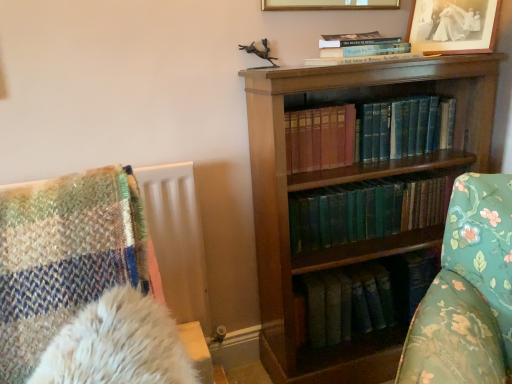
Find the location of a particular element. The width and height of the screenshot is (512, 384). black paper picture frame at upper right, which ranks as the first picture frame in right-to-left order is located at coordinates (453, 26).

Identify the location of blue leather book at center, which is the 2th book from top to bottom. (393, 130).

You are a GUI agent. You are given a task and a screenshot of the screen. Output one action in this format:
    pyautogui.click(x=<x>, y=<y>)
    Task: Click on the gold/glossy picture frame at upper center, the 2th picture frame when ordered from right to left
    
    Given the screenshot: What is the action you would take?
    pyautogui.click(x=329, y=5)

The height and width of the screenshot is (384, 512). I want to click on hardcover book at upper center, which is the first book from top to bottom, so click(361, 49).

In order to face hardcover book at upper center, which is the 3th book from bottom to top, should I rotate leftwards or rightwards?

To align with it, rotate right about 14.108°.

Describe the element at coordinates (343, 185) in the screenshot. I see `wooden bookcase at center` at that location.

Find the location of `black paper picture frame at upper right, which ranks as the first picture frame in right-to-left order`. black paper picture frame at upper right, which ranks as the first picture frame in right-to-left order is located at coordinates (453, 26).

Is hardcover book at upper center, which is the 3th book from bottom to top, next to blue leather book at center, which is the 2th book from top to bottom, and touching it?

hardcover book at upper center, which is the 3th book from bottom to top, and blue leather book at center, which is the 2th book from top to bottom, are clearly separated.

Considering the points (353, 34) and (321, 167), which point is behind, point (353, 34) or point (321, 167)?

Point (353, 34)

Consider the image. In terms of height, does hardcover book at upper center, which is the 3th book from bottom to top, look taller or shorter compared to blue leather book at center, which is the 2th book from top to bottom?

Clearly, hardcover book at upper center, which is the 3th book from bottom to top, is shorter compared to blue leather book at center, which is the 2th book from top to bottom.

Would you say hardcover book at upper center, which is the first book from top to bottom, is to the left or to the right of blue leather book at center, which is the 2th book from top to bottom, in the picture?

Based on their positions, hardcover book at upper center, which is the first book from top to bottom, is located to the left of blue leather book at center, which is the 2th book from top to bottom.

Are gold/glossy picture frame at upper center, which appears as the first picture frame when viewed from the left, and hardcover book at upper center, which is the 3th book from bottom to top, located far from each other?

No, gold/glossy picture frame at upper center, which appears as the first picture frame when viewed from the left, is not far away from hardcover book at upper center, which is the 3th book from bottom to top.

Relative to hardcover book at upper center, which is the 3th book from bottom to top, is gold/glossy picture frame at upper center, which appears as the first picture frame when viewed from the left, in front or behind?

Clearly, gold/glossy picture frame at upper center, which appears as the first picture frame when viewed from the left, is in front of hardcover book at upper center, which is the 3th book from bottom to top.

Which is less distant, (274, 1) or (400, 49)?

Point (274, 1) appears to be farther away from the viewer than point (400, 49).

Considering the relative sizes of gold/glossy picture frame at upper center, which appears as the first picture frame when viewed from the left, and hardcover book at upper center, which is the first book from top to bottom, in the image provided, is gold/glossy picture frame at upper center, which appears as the first picture frame when viewed from the left, wider than hardcover book at upper center, which is the first book from top to bottom,?

No.

Based on the photo, can green leather book at center, the 1th book in the bottom-to-top sequence, be found inside black paper picture frame at upper right, which is the 2th picture frame from left to right?

No, green leather book at center, the 1th book in the bottom-to-top sequence, is located outside of black paper picture frame at upper right, which is the 2th picture frame from left to right.

Between black paper picture frame at upper right, which ranks as the first picture frame in right-to-left order, and green leather book at center, the 1th book in the bottom-to-top sequence, which one has larger width?

Wider between the two is green leather book at center, the 1th book in the bottom-to-top sequence.

In terms of height, does black paper picture frame at upper right, which is the 2th picture frame from left to right, look taller or shorter compared to green leather book at center, the 1th book in the bottom-to-top sequence?

Clearly, black paper picture frame at upper right, which is the 2th picture frame from left to right, is taller compared to green leather book at center, the 1th book in the bottom-to-top sequence.

In terms of width, does hardcover book at upper center, which is the 3th book from bottom to top, look wider or thinner when compared to green leather book at center, the 1th book in the bottom-to-top sequence?

hardcover book at upper center, which is the 3th book from bottom to top, is wider than green leather book at center, the 1th book in the bottom-to-top sequence.

Is hardcover book at upper center, which is the 3th book from bottom to top, far from green leather book at center, the 1th book in the bottom-to-top sequence?

hardcover book at upper center, which is the 3th book from bottom to top, is near green leather book at center, the 1th book in the bottom-to-top sequence, not far away.

Is hardcover book at upper center, which is the 3th book from bottom to top, to the right of green leather book at center, the 1th book in the bottom-to-top sequence, from the viewer's perspective?

In fact, hardcover book at upper center, which is the 3th book from bottom to top, is to the left of green leather book at center, the 1th book in the bottom-to-top sequence.

Can you see blue leather book at center, the 2th book ordered from the bottom, touching gold/glossy picture frame at upper center, which appears as the first picture frame when viewed from the left?

No, blue leather book at center, the 2th book ordered from the bottom, is not next to gold/glossy picture frame at upper center, which appears as the first picture frame when viewed from the left.

Is blue leather book at center, which is the 2th book from top to bottom, wider or thinner than gold/glossy picture frame at upper center, the 2th picture frame when ordered from right to left?

Considering their sizes, blue leather book at center, which is the 2th book from top to bottom, looks broader than gold/glossy picture frame at upper center, the 2th picture frame when ordered from right to left.

What are the coordinates of `the 2nd book below the gold/glossy picture frame at upper center, which appears as the first picture frame when viewed from the left (from a real-world perspective)` in the screenshot? It's located at (393, 130).

Which is more to the right, blue leather book at center, which is the 2th book from top to bottom, or gold/glossy picture frame at upper center, which appears as the first picture frame when viewed from the left?

From the viewer's perspective, blue leather book at center, which is the 2th book from top to bottom, appears more on the right side.

Is hardcover book at upper center, which is the 3th book from bottom to top, to the right of gold/glossy picture frame at upper center, which appears as the first picture frame when viewed from the left, from the viewer's perspective?

Indeed, hardcover book at upper center, which is the 3th book from bottom to top, is positioned on the right side of gold/glossy picture frame at upper center, which appears as the first picture frame when viewed from the left.

Can you confirm if hardcover book at upper center, which is the 3th book from bottom to top, is thinner than gold/glossy picture frame at upper center, the 2th picture frame when ordered from right to left?

No, hardcover book at upper center, which is the 3th book from bottom to top, is not thinner than gold/glossy picture frame at upper center, the 2th picture frame when ordered from right to left.

Is wooden bookcase at center inside blue leather book at center, the 2th book ordered from the bottom?

No, wooden bookcase at center is not surrounded by blue leather book at center, the 2th book ordered from the bottom.

I want to click on bookcase on the right of blue leather book at center, which is the 2th book from top to bottom, so click(x=343, y=185).

Considering the relative sizes of blue leather book at center, the 2th book ordered from the bottom, and wooden bookcase at center in the image provided, is blue leather book at center, the 2th book ordered from the bottom, wider than wooden bookcase at center?

Incorrect, the width of blue leather book at center, the 2th book ordered from the bottom, does not surpass that of wooden bookcase at center.

Which of these two, blue leather book at center, the 2th book ordered from the bottom, or wooden bookcase at center, is bigger?

wooden bookcase at center.

From a real-world perspective, starting from the hardcover book at upper center, which is the 3th book from bottom to top, which book is the 1st one below it? Please provide its 2D coordinates.

[(393, 130)]

Locate an element on the screen. The height and width of the screenshot is (384, 512). picture frame on the left of hardcover book at upper center, which is the 3th book from bottom to top is located at coordinates (329, 5).

Looking at the image, which one is located further to green leather book at center, positioned as the third book in top-to-bottom order, black paper picture frame at upper right, which ranks as the first picture frame in right-to-left order, or blue leather book at center, the 2th book ordered from the bottom?

black paper picture frame at upper right, which ranks as the first picture frame in right-to-left order, is positioned further to the anchor green leather book at center, positioned as the third book in top-to-bottom order.

From the image, which object appears to be farther from gold/glossy picture frame at upper center, which appears as the first picture frame when viewed from the left, hardcover book at upper center, which is the first book from top to bottom, or blue leather book at center, the 2th book ordered from the bottom?

Based on the image, blue leather book at center, the 2th book ordered from the bottom, appears to be further to gold/glossy picture frame at upper center, which appears as the first picture frame when viewed from the left.

Considering their positions, is black paper picture frame at upper right, which is the 2th picture frame from left to right, positioned closer to hardcover book at upper center, which is the first book from top to bottom, than wooden bookcase at center?

black paper picture frame at upper right, which is the 2th picture frame from left to right, lies closer to hardcover book at upper center, which is the first book from top to bottom, than the other object.

Which object lies further to the anchor point wooden bookcase at center, blue leather book at center, the 2th book ordered from the bottom, or black paper picture frame at upper right, which ranks as the first picture frame in right-to-left order?

black paper picture frame at upper right, which ranks as the first picture frame in right-to-left order, lies further to wooden bookcase at center than the other object.

Looking at the image, which one is located closer to hardcover book at upper center, which is the 3th book from bottom to top, black paper picture frame at upper right, which is the 2th picture frame from left to right, or blue leather book at center, which is the 2th book from top to bottom?

black paper picture frame at upper right, which is the 2th picture frame from left to right, is positioned closer to the anchor hardcover book at upper center, which is the 3th book from bottom to top.

Estimate the real-world distances between objects in this image. Which object is further from blue leather book at center, the 2th book ordered from the bottom, green leather book at center, the 1th book in the bottom-to-top sequence, or wooden bookcase at center?

The object further to blue leather book at center, the 2th book ordered from the bottom, is wooden bookcase at center.

When comparing their distances from green leather book at center, the 1th book in the bottom-to-top sequence, does black paper picture frame at upper right, which is the 2th picture frame from left to right, or gold/glossy picture frame at upper center, which appears as the first picture frame when viewed from the left, seem further?

gold/glossy picture frame at upper center, which appears as the first picture frame when viewed from the left, lies further to green leather book at center, the 1th book in the bottom-to-top sequence, than the other object.

When comparing their distances from green leather book at center, the 1th book in the bottom-to-top sequence, does blue leather book at center, the 2th book ordered from the bottom, or wooden bookcase at center seem further?

blue leather book at center, the 2th book ordered from the bottom, lies further to green leather book at center, the 1th book in the bottom-to-top sequence, than the other object.

In order to click on picture frame between gold/glossy picture frame at upper center, which appears as the first picture frame when viewed from the left, and blue leather book at center, the 2th book ordered from the bottom, in the up-down direction in this screenshot , I will do `click(453, 26)`.

This screenshot has width=512, height=384. I want to click on picture frame between gold/glossy picture frame at upper center, the 2th picture frame when ordered from right to left, and wooden bookcase at center, in the vertical direction, so click(x=453, y=26).

The width and height of the screenshot is (512, 384). I want to click on book between hardcover book at upper center, which is the first book from top to bottom, and green leather book at center, the 1th book in the bottom-to-top sequence, in the up-down direction, so click(x=393, y=130).

What are the coordinates of `picture frame between gold/glossy picture frame at upper center, the 2th picture frame when ordered from right to left, and green leather book at center, the 1th book in the bottom-to-top sequence, in the vertical direction` in the screenshot? It's located at (453, 26).